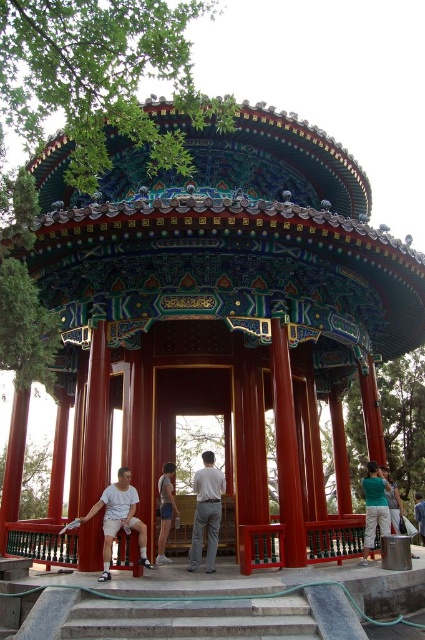
Question: Which point appears farthest from the camera in this image?

Choices:
 (A) (158, 500)
 (B) (218, 476)
 (C) (104, 568)
 (D) (283, 630)

Answer: (A)

Question: Is concrete stairs at center below white cotton shirt at lower center?

Choices:
 (A) no
 (B) yes

Answer: (B)

Question: Does concrete stairs at center have a smaller size compared to denim shorts at center?

Choices:
 (A) yes
 (B) no

Answer: (A)

Question: Can you confirm if white cotton shirt at lower center is bigger than denim shorts at center?

Choices:
 (A) yes
 (B) no

Answer: (A)

Question: Which object is the closest to the white cotton shirt at lower center?

Choices:
 (A) denim shorts at center
 (B) concrete stairs at center

Answer: (A)

Question: Which object is the closest to the concrete stairs at center?

Choices:
 (A) light brown fabric pants at center
 (B) white cotton shirt at lower center

Answer: (B)